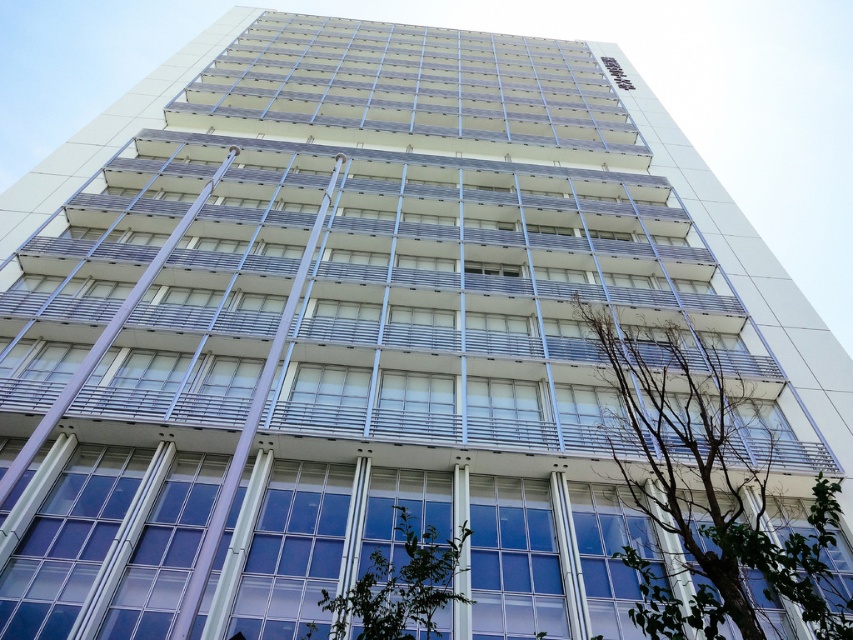
You are standing at the base of the high rise building and want to take a photo of the green leafy tree at right. Which direction should you face to capture the tree in your camera frame?

The green leafy tree at right is located at point 0.770 on the x axis and 0.834 on the y axis. Since the coordinates are in the upper right quadrant, you should face towards the right side of the building to capture the tree in your camera frame.

In the scene shown: You are standing in front of the modern highrise building and see two green leafy trees. One is the green leafy tree at right and the other is the green leafy tree at center. Which tree is located to the right of the other?

The green leafy tree at right is positioned on the right side of green leafy tree at center.